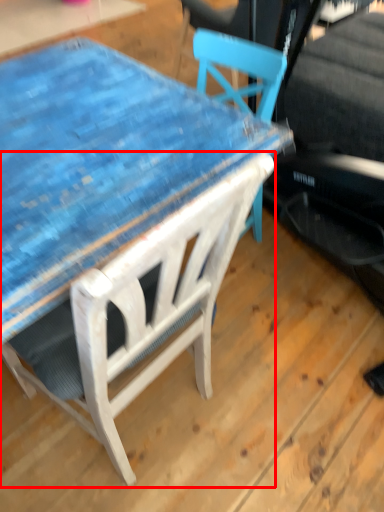
Question: From the image's perspective, where is chair (annotated by the red box) located relative to table?

Choices:
 (A) below
 (B) above

Answer: (A)